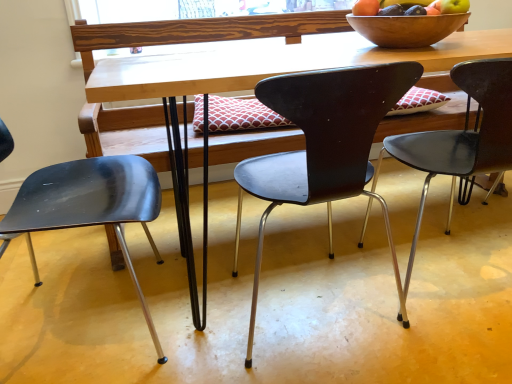
Question: Considering the relative positions of matte black chair at center, the 2th chair positioned from the left, and metallic black chair at left, the 3th chair positioned from the right, in the image provided, is matte black chair at center, the 2th chair positioned from the left, to the left or to the right of metallic black chair at left, the 3th chair positioned from the right,?

Choices:
 (A) left
 (B) right

Answer: (B)

Question: From the image's perspective, is matte black chair at center, marked as the 2th chair in a right-to-left arrangement, above or below metallic black chair at left, the 3th chair positioned from the right?

Choices:
 (A) below
 (B) above

Answer: (B)

Question: Based on their relative distances, which object is farther from the wooden bowl at upper right?

Choices:
 (A) wooden desk at center
 (B) metallic black chair at left, the 3th chair positioned from the right
 (C) matte black chair at center, the 2th chair positioned from the left
 (D) matte black chair at center, arranged as the 3th chair when viewed from the left

Answer: (B)

Question: Estimate the real-world distances between objects in this image. Which object is farther from the wooden bowl at upper right?

Choices:
 (A) matte black chair at center, marked as the 2th chair in a right-to-left arrangement
 (B) matte black chair at center, arranged as the 3th chair when viewed from the left
 (C) metallic black chair at left, the 3th chair positioned from the right
 (D) wooden desk at center

Answer: (C)